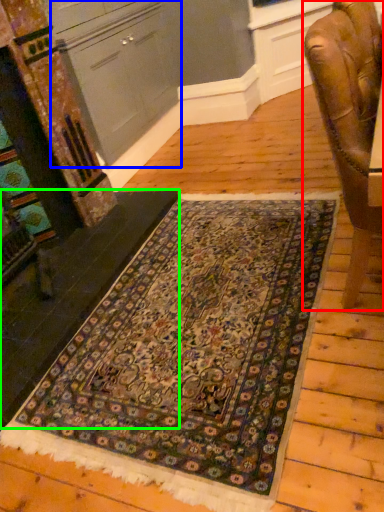
Question: Based on their relative distances, which object is farther from chair (highlighted by a red box)? Choose from cabinetry (highlighted by a blue box) and stair (highlighted by a green box).

Choices:
 (A) cabinetry
 (B) stair

Answer: (A)